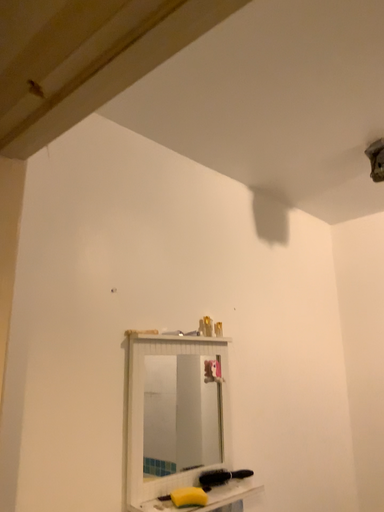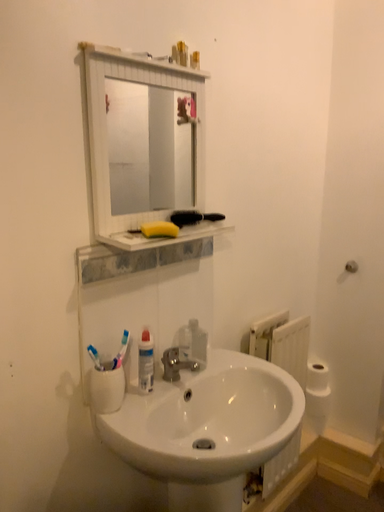
Question: How did the camera likely rotate when shooting the video?

Choices:
 (A) rotated upward
 (B) rotated downward

Answer: (B)